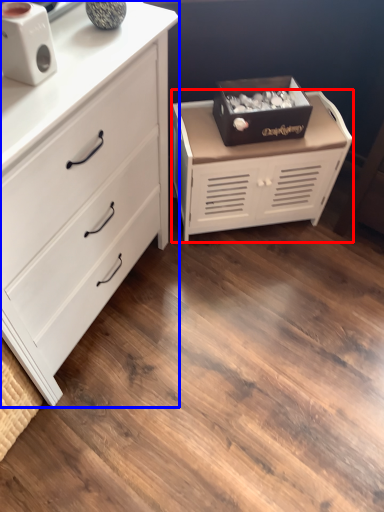
Question: Which object is further to the camera taking this photo, chest of drawers (highlighted by a red box) or chest of drawers (highlighted by a blue box)?

Choices:
 (A) chest of drawers
 (B) chest of drawers

Answer: (A)